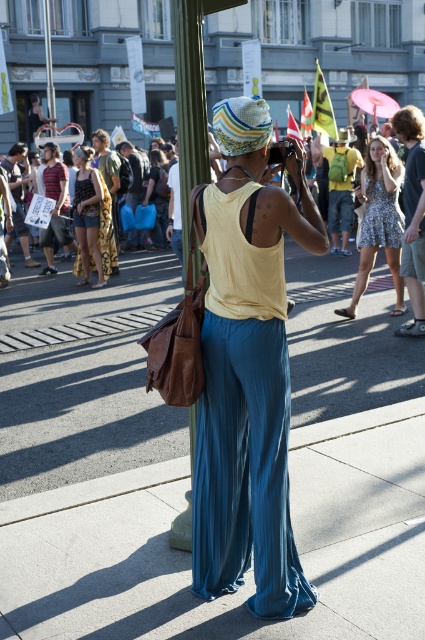
Does dusty blue dress at center have a larger size compared to matte black tank top at center?

Yes, dusty blue dress at center is bigger than matte black tank top at center.

Between point (388, 202) and point (81, 182), which one is positioned behind?

The point (81, 182) is more distant.

Locate an element on the screen. The image size is (425, 640). dusty blue dress at center is located at coordinates (379, 220).

Which is behind, point (221, 432) or point (365, 211)?

Point (365, 211)

Which is more to the right, blue pleated pants at center or dusty blue dress at center?

Positioned to the right is dusty blue dress at center.

The height and width of the screenshot is (640, 425). Describe the element at coordinates (244, 468) in the screenshot. I see `blue pleated pants at center` at that location.

The width and height of the screenshot is (425, 640). What are the coordinates of `blue pleated pants at center` in the screenshot? It's located at (244, 468).

Between blue fabric pants at center and blue pleated pants at center, which one appears on the right side from the viewer's perspective?

Positioned to the right is blue fabric pants at center.

Between point (311, 566) and point (269, 614), which one is positioned behind?

Point (311, 566)

The height and width of the screenshot is (640, 425). What do you see at coordinates (189, 465) in the screenshot? I see `blue fabric pants at center` at bounding box center [189, 465].

Where is `blue fabric pants at center`? The height and width of the screenshot is (640, 425). blue fabric pants at center is located at coordinates (189, 465).